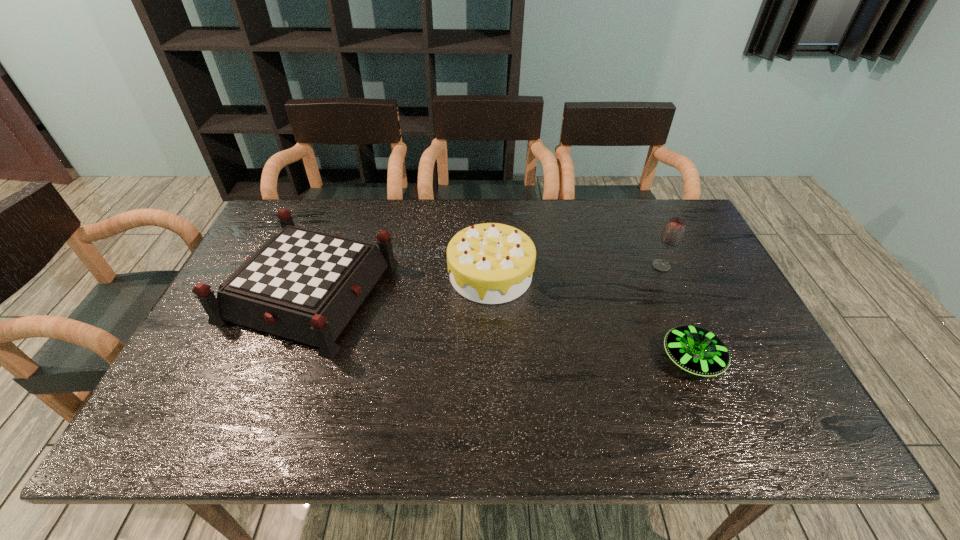
Find the location of a particular element. glass drink container that is at the right edge is located at coordinates (673, 232).

Locate an element on the screen. Image resolution: width=960 pixels, height=540 pixels. saucer that is at the right edge is located at coordinates (696, 350).

Locate an element on the screen. Image resolution: width=960 pixels, height=540 pixels. object that is at the far left corner is located at coordinates (304, 285).

In the image, there is a desktop. At what (x,y) coordinates should I click in order to perform the action: click on vacant space at the far edge. Please return your answer as a coordinate pair (x, y). Image resolution: width=960 pixels, height=540 pixels. Looking at the image, I should click on (502, 201).

This screenshot has width=960, height=540. In the image, there is a desktop. What are the coordinates of `vacant space at the near edge` in the screenshot? It's located at (387, 418).

Locate an element on the screen. Image resolution: width=960 pixels, height=540 pixels. free region at the left edge is located at coordinates (179, 390).

Locate an element on the screen. vacant space at the far left corner of the desktop is located at coordinates (317, 218).

I want to click on vacant space at the near left corner of the desktop, so click(x=200, y=430).

Locate an element on the screen. This screenshot has height=540, width=960. vacant space at the far right corner of the desktop is located at coordinates (658, 199).

In order to click on vacant region between the leftmost object and the second object from left to right in this screenshot , I will do `click(400, 283)`.